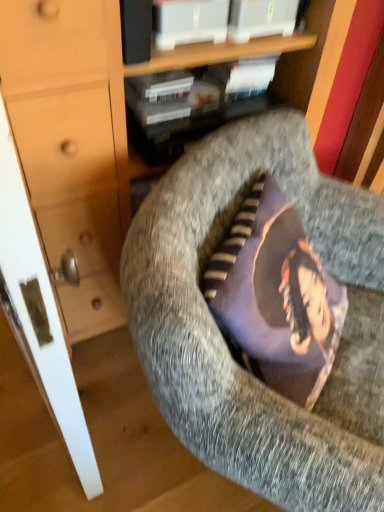
Question: Is matte black book at upper center at the right side of matte wood dresser at center?

Choices:
 (A) yes
 (B) no

Answer: (B)

Question: Could you tell me if matte black book at upper center is turned towards matte wood dresser at center?

Choices:
 (A) no
 (B) yes

Answer: (B)

Question: Does matte black book at upper center have a lesser width compared to matte wood dresser at center?

Choices:
 (A) yes
 (B) no

Answer: (A)

Question: Would you say matte black book at upper center is a long distance from matte wood dresser at center?

Choices:
 (A) no
 (B) yes

Answer: (A)

Question: Is the depth of matte black book at upper center less than that of matte wood dresser at center?

Choices:
 (A) yes
 (B) no

Answer: (B)

Question: Relative to matte black book at upper center, is matte wood dresser at center in front or behind?

Choices:
 (A) front
 (B) behind

Answer: (A)

Question: Which is correct: matte wood dresser at center is inside matte black book at upper center, or outside of it?

Choices:
 (A) outside
 (B) inside

Answer: (A)

Question: Looking at their shapes, would you say matte wood dresser at center is wider or thinner than matte black book at upper center?

Choices:
 (A) wide
 (B) thin

Answer: (A)

Question: Does point (77, 310) appear closer or farther from the camera than point (198, 86)?

Choices:
 (A) closer
 (B) farther

Answer: (B)

Question: Do you think matte black book at upper center is within matte wood dresser at center, or outside of it?

Choices:
 (A) inside
 (B) outside

Answer: (A)

Question: From their relative heights in the image, would you say matte black book at upper center is taller or shorter than matte wood dresser at center?

Choices:
 (A) tall
 (B) short

Answer: (B)

Question: Considering the positions of matte black book at upper center and matte wood dresser at center in the image, is matte black book at upper center wider or thinner than matte wood dresser at center?

Choices:
 (A) thin
 (B) wide

Answer: (A)

Question: Considering the positions of matte black book at upper center and matte wood dresser at center in the image, is matte black book at upper center bigger or smaller than matte wood dresser at center?

Choices:
 (A) small
 (B) big

Answer: (A)

Question: From the image's perspective, is textured gray cushion at center positioned above or below matte wood dresser at center?

Choices:
 (A) below
 (B) above

Answer: (A)

Question: From a real-world perspective, is textured gray cushion at center above or below matte wood dresser at center?

Choices:
 (A) above
 (B) below

Answer: (B)